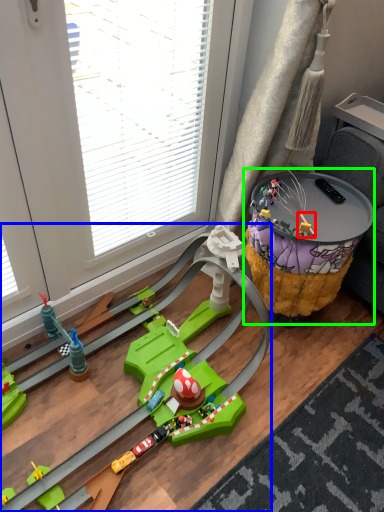
Question: Considering the real-world distances, which object is farthest from toy (highlighted by a red box)? toy (highlighted by a blue box) or table (highlighted by a green box)?

Choices:
 (A) toy
 (B) table

Answer: (A)